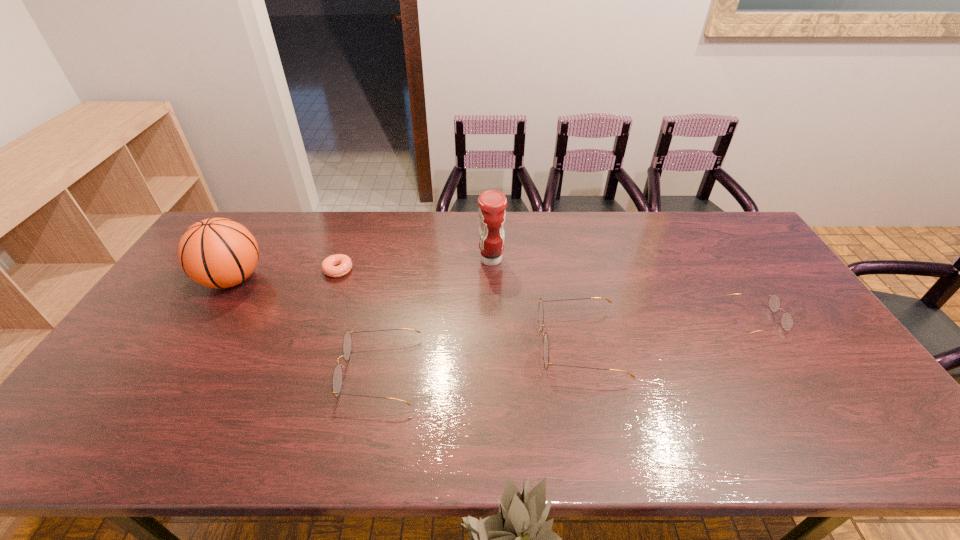
Locate an element on the screen. The width and height of the screenshot is (960, 540). the fourth tallest object is located at coordinates (337, 379).

This screenshot has height=540, width=960. Identify the location of the leftmost spectacles. (337, 379).

The image size is (960, 540). In order to click on the fifth object from left to right in this screenshot , I will do `click(540, 311)`.

Where is `the shortest spectacles`? The width and height of the screenshot is (960, 540). the shortest spectacles is located at coordinates (787, 321).

Identify the location of the rightmost spectacles. This screenshot has width=960, height=540. (787, 321).

Image resolution: width=960 pixels, height=540 pixels. In order to click on the fifth object from right to left in this screenshot , I will do `click(329, 267)`.

Where is `doughnut`? doughnut is located at coordinates (329, 267).

Locate an element on the screen. The image size is (960, 540). condiment is located at coordinates (492, 203).

Where is `the leftmost object`? The width and height of the screenshot is (960, 540). the leftmost object is located at coordinates (217, 252).

Identify the location of free space located 0.210m on the temples of the fourth object from right to left. (260, 372).